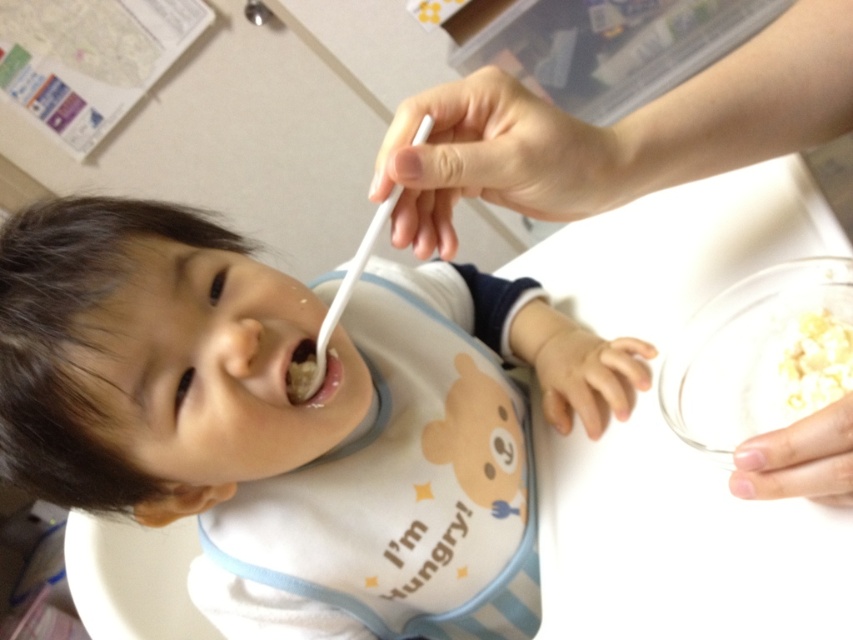
You are a parent trying to feed your child. You have a white plastic spoon at upper center and white matte cereal at upper right. Which object is closer to the child?

The white plastic spoon at upper center is closer to the child because it is positioned to the left of the white matte cereal at upper right, which is further away.

You are a robotic arm trying to reach a specific point in the image to assist in feeding the child. The point you need to reach is at coordinates point [502,520]. Given that your maximum reach is 28 inches, can you successfully reach that point?

The distance of point [502,520] from camera is 27.08 inches. Since your maximum reach is 28 inches, you can successfully reach that point.